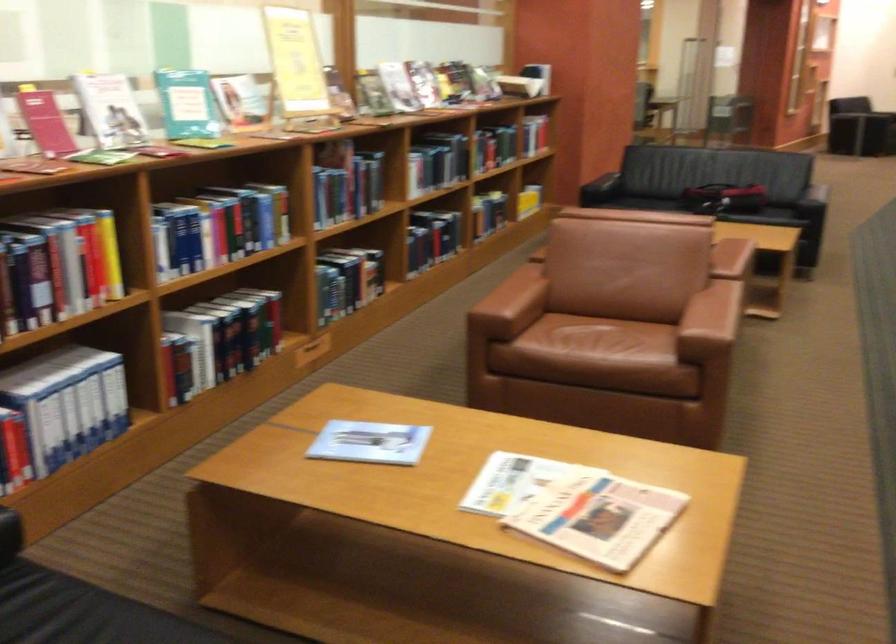
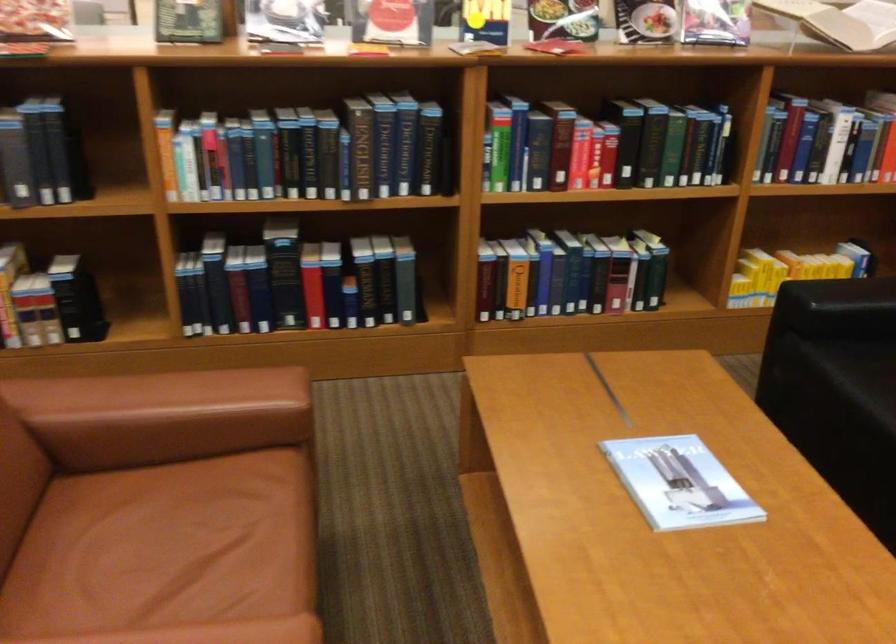
Where in the second image is the point corresponding to [495,142] from the first image?

(601, 146)